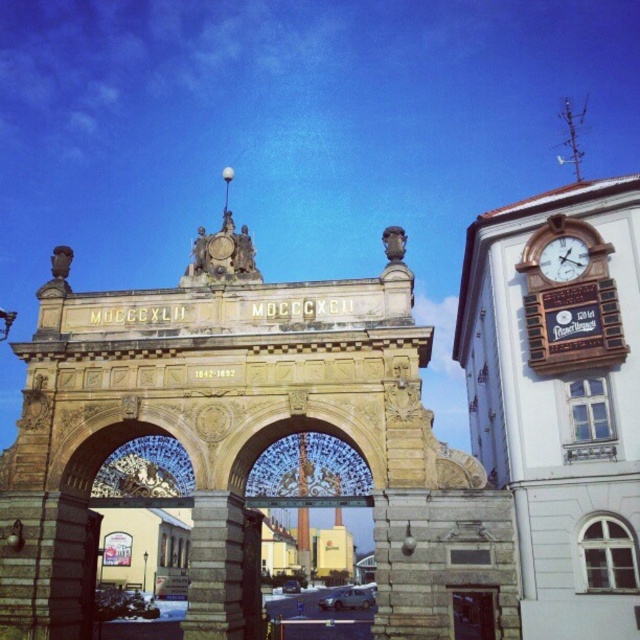
Question: Which point is closer to the camera taking this photo?

Choices:
 (A) (189, 330)
 (B) (541, 252)

Answer: (B)

Question: Is golden stone arch at center smaller than gold metallic clock at upper right?

Choices:
 (A) no
 (B) yes

Answer: (A)

Question: In this image, where is golden stone arch at center located relative to gold metallic clock at upper right?

Choices:
 (A) right
 (B) left

Answer: (B)

Question: Can you confirm if golden stone arch at center is smaller than brown wooden door at center?

Choices:
 (A) no
 (B) yes

Answer: (A)

Question: Which point is farther to the camera?

Choices:
 (A) golden stone arch at center
 (B) brown wooden door at center
 (C) gold metallic clock at upper right

Answer: (C)

Question: Which point is farther to the camera?

Choices:
 (A) brown wooden door at center
 (B) golden stone arch at center
 (C) gold metallic clock at upper right

Answer: (C)